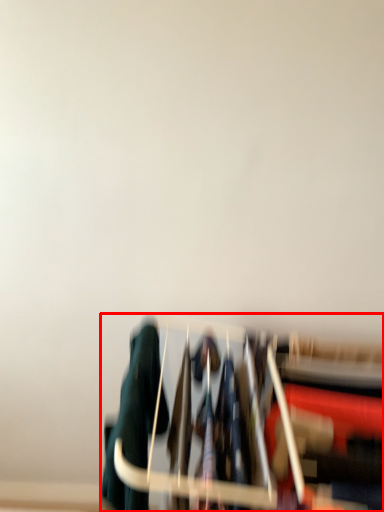
Question: From the image's perspective, what is the correct spatial relationship of furniture (annotated by the red box) in relation to clothing?

Choices:
 (A) below
 (B) above

Answer: (A)